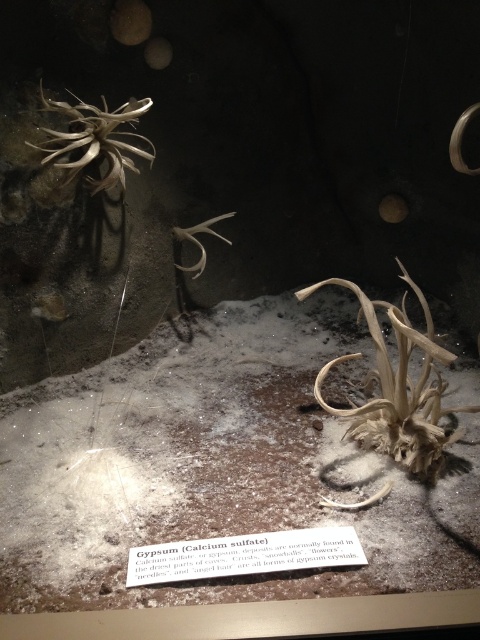
Question: Which point appears closest to the camera in this image?

Choices:
 (A) (405, 278)
 (B) (87, 154)

Answer: (B)

Question: Does fibrous beige plant at center come in front of light brown textured plant at upper left?

Choices:
 (A) no
 (B) yes

Answer: (B)

Question: Which point is farther from the camera taking this photo?

Choices:
 (A) pos(122,154)
 (B) pos(434,412)

Answer: (A)

Question: Can you confirm if fibrous beige plant at center is positioned to the right of light brown textured plant at upper left?

Choices:
 (A) yes
 (B) no

Answer: (A)

Question: Does fibrous beige plant at center have a greater width compared to light brown textured plant at upper left?

Choices:
 (A) no
 (B) yes

Answer: (B)